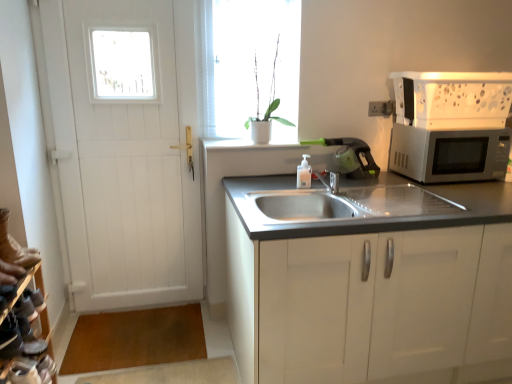
At what (x,y) coordinates should I click in order to perform the action: click on vacant area situated below white wooden door at left (from a real-world perspective). Please return your answer as a coordinate pair (x, y). Looking at the image, I should click on (146, 302).